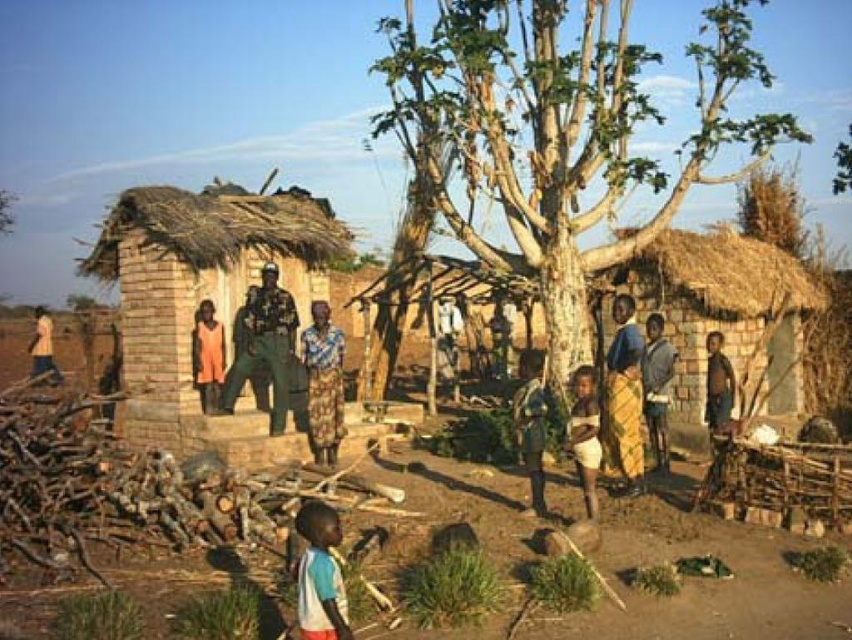
Which is more to the right, brown brick hut at center or light brown skin at left?

brown brick hut at center

Based on the photo, does brown brick hut at center appear on the left side of light brown skin at left?

In fact, brown brick hut at center is to the right of light brown skin at left.

The image size is (852, 640). Identify the location of brown brick hut at center. (199, 284).

Is light blue t-shirt at lower center to the left of light brown skin at center from the viewer's perspective?

Indeed, light blue t-shirt at lower center is positioned on the left side of light brown skin at center.

Which of these two, light blue t-shirt at lower center or light brown skin at center, stands shorter?

light blue t-shirt at lower center is shorter.

Is point (303, 614) in front of point (597, 460)?

Yes, point (303, 614) is closer to viewer.

Identify the location of light blue t-shirt at lower center. The image size is (852, 640). (x=320, y=576).

Looking at this image, which is below, brown brick hut at center or yellow woven fabric at right?

yellow woven fabric at right is below.

Looking at this image, between brown brick hut at center and yellow woven fabric at right, which one is positioned higher?

Positioned higher is brown brick hut at center.

You are a GUI agent. You are given a task and a screenshot of the screen. Output one action in this format:
    pyautogui.click(x=<x>, y=<y>)
    Task: Click on the brown brick hut at center
    
    Given the screenshot: What is the action you would take?
    pos(199,284)